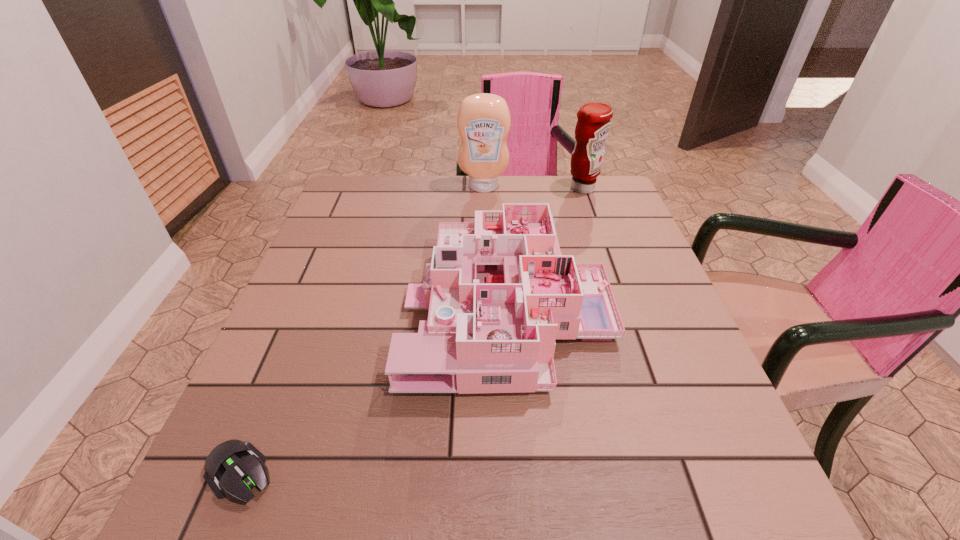
Identify the location of vacant space in between the computer mouse and the left condiment. The width and height of the screenshot is (960, 540). (362, 330).

At what (x,y) coordinates should I click in order to perform the action: click on empty space between the left condiment and the right condiment. Please return your answer as a coordinate pair (x, y). Image resolution: width=960 pixels, height=540 pixels. Looking at the image, I should click on (533, 188).

Locate which object ranks second in proximity to the left condiment. Please provide its 2D coordinates. Your answer should be formatted as a tuple, i.e. [(x, y)], where the tuple contains the x and y coordinates of a point satisfying the conditions above.

[(499, 291)]

Identify which object is located as the nearest to the dollhouse. Please provide its 2D coordinates. Your answer should be formatted as a tuple, i.e. [(x, y)], where the tuple contains the x and y coordinates of a point satisfying the conditions above.

[(233, 467)]

Where is `blank space that satisfies the following two spatial constraints: 1. on the label of the left condiment; 2. on the right side of the right condiment`? blank space that satisfies the following two spatial constraints: 1. on the label of the left condiment; 2. on the right side of the right condiment is located at coordinates (484, 188).

Where is `vacant space that satisfies the following two spatial constraints: 1. on the label of the left condiment; 2. on the left side of the right condiment`? The width and height of the screenshot is (960, 540). vacant space that satisfies the following two spatial constraints: 1. on the label of the left condiment; 2. on the left side of the right condiment is located at coordinates (484, 188).